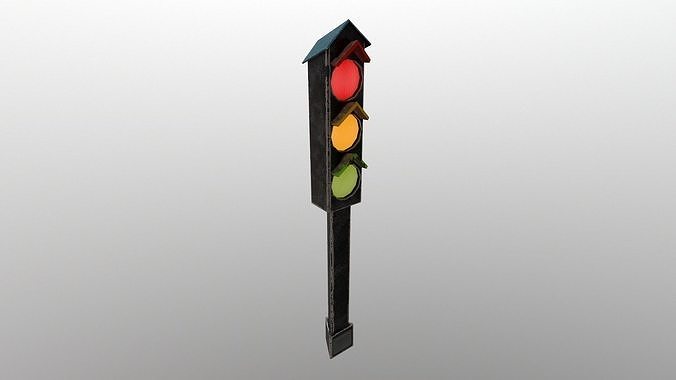
This screenshot has height=380, width=676. What are the coordinates of `above light` in the screenshot? It's located at (345, 8).